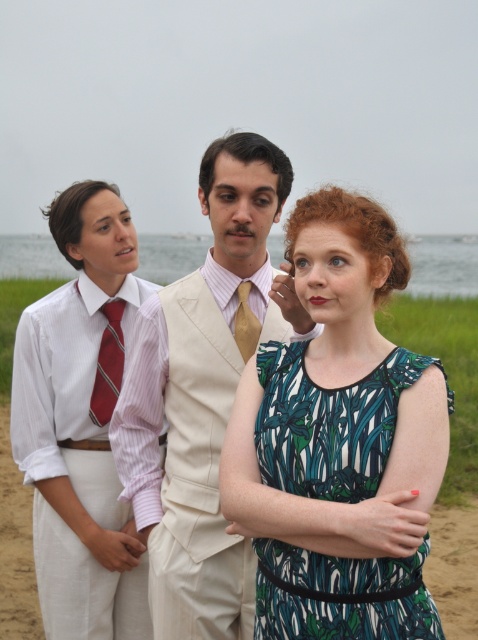
Can you confirm if matte striped shirt at left is shorter than striped silk tie at center?

No, matte striped shirt at left is not shorter than striped silk tie at center.

Which is behind, point (99, 440) or point (113, 380)?

The point (113, 380) is behind.

The image size is (478, 640). I want to click on matte striped shirt at left, so click(80, 422).

Does point (113, 356) come in front of point (257, 323)?

No.

From the picture: Does striped silk tie at center have a greater width compared to gold silk tie at center?

Correct, the width of striped silk tie at center exceeds that of gold silk tie at center.

Is point (113, 364) more distant than point (242, 336)?

Yes, point (113, 364) is behind point (242, 336).

This screenshot has height=640, width=478. I want to click on striped silk tie at center, so click(x=108, y=364).

Does light beige vest at center have a lesser height compared to gold silk tie at center?

In fact, light beige vest at center may be taller than gold silk tie at center.

Does light beige vest at center have a greater height compared to gold silk tie at center?

Indeed, light beige vest at center has a greater height compared to gold silk tie at center.

What are the coordinates of `light beige vest at center` in the screenshot? It's located at (203, 394).

Find the location of a particular element. light beige vest at center is located at coordinates (203, 394).